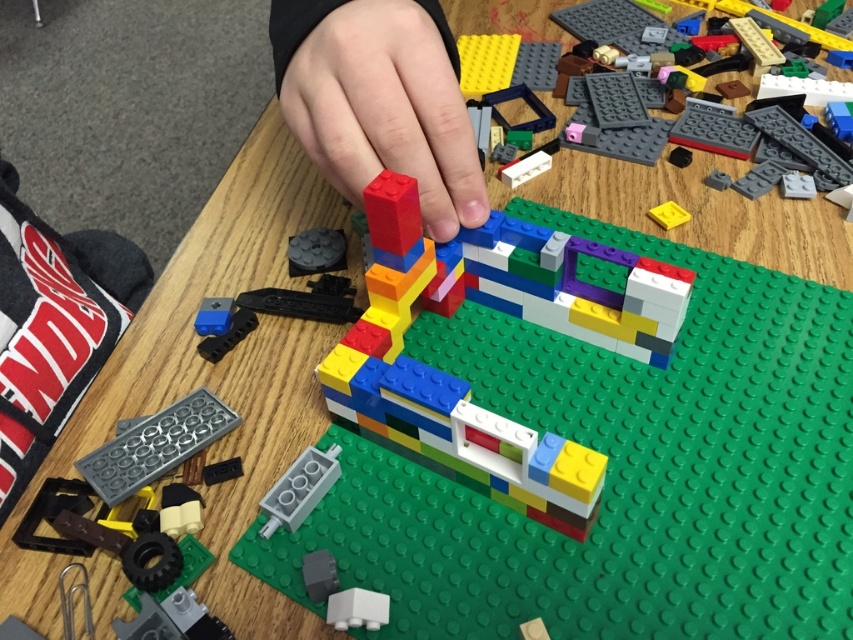
You are a child trying to build a tower with the LEGO bricks. You have a matte plastic hand at center and a translucent plastic brick at center. Which object should you choose if you want to add a taller piece to your tower?

You should choose the translucent plastic brick at center because it is taller than the matte plastic hand at center.